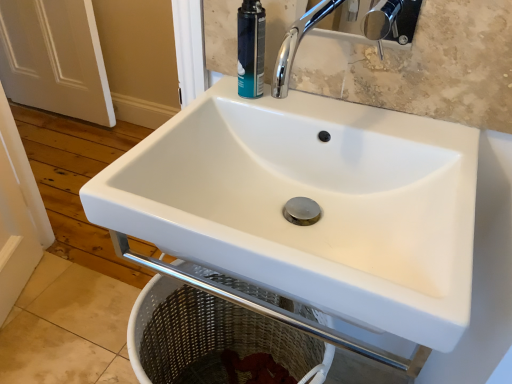
You are a GUI agent. You are given a task and a screenshot of the screen. Output one action in this format:
    pyautogui.click(x=<x>, y=<y>)
    Task: Click on the vacant area to the right of teal matte shaving cream can at upper center
    The height and width of the screenshot is (384, 512).
    Given the screenshot: What is the action you would take?
    tap(325, 115)